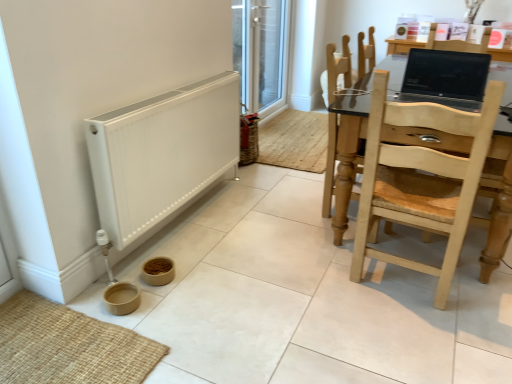
Find the location of a particular element. vacant area situated below white matte heater at lower left (from a real-world perspective) is located at coordinates (187, 220).